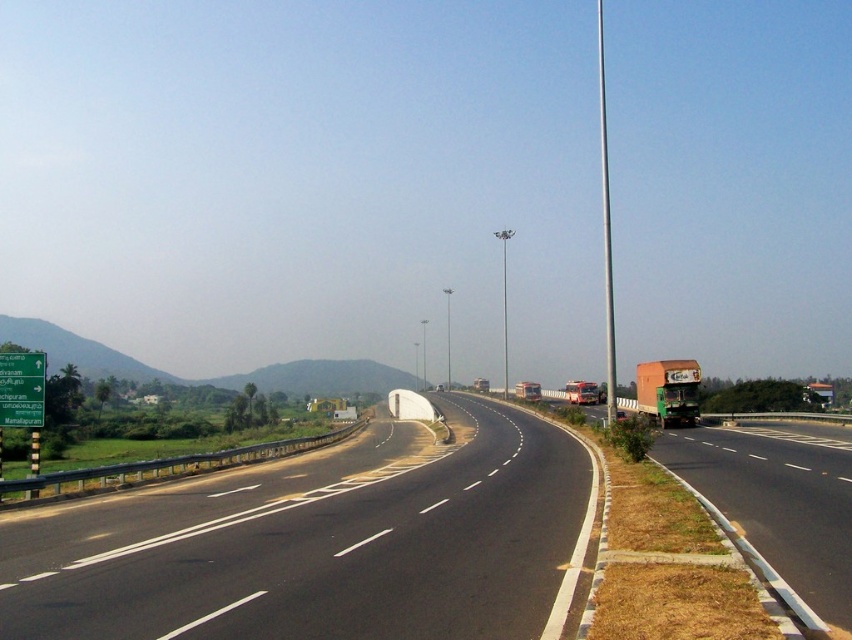
You are a driver approaching the highway and need to determine the distance between two points on the road. The first point is at coordinate point (x=747, y=548) and the second point is at coordinate point (x=609, y=346). Which point is closer to you as you drive towards the highway?

Point (x=747, y=548) is closer to the viewer than point (x=609, y=346).

You are standing at point (309, 572) on the highway. You need to reach a point that is 37.61 feet away. Which direction should you walk to get there?

You should walk towards the large orange truck parked near the edge close to the guardrail because the distance between them is 37.61 feet.

You are a driver approaching the highway and see the green matte truck at right and the silver metallic pole at right. Which object appears taller from your perspective?

The silver metallic pole at right appears taller because it is taller than the green matte truck at right.